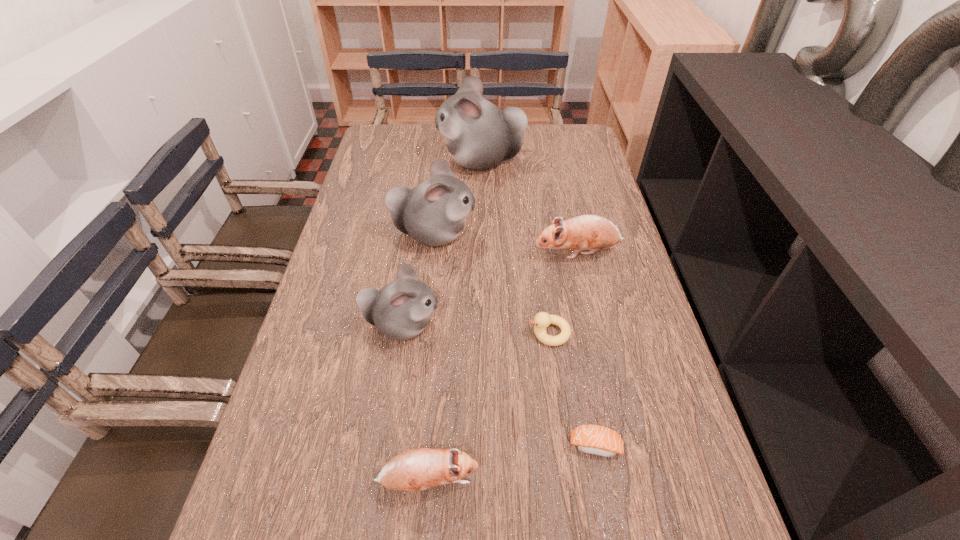
Locate an element on the screen. The image size is (960, 540). vacant space located at the face of the bigger brown hamster is located at coordinates (516, 253).

Where is `free location located 0.240m at the face of the nearest hamster`? Image resolution: width=960 pixels, height=540 pixels. free location located 0.240m at the face of the nearest hamster is located at coordinates (612, 481).

Identify the location of blank space located 0.390m at the beak of the duckling. The image size is (960, 540). (359, 333).

Locate an element on the screen. The height and width of the screenshot is (540, 960). vacant space located 0.060m at the beak of the duckling is located at coordinates (502, 333).

Where is `vacant area located 0.260m at the beak of the duckling`? This screenshot has width=960, height=540. vacant area located 0.260m at the beak of the duckling is located at coordinates (416, 333).

Locate an element on the screen. The height and width of the screenshot is (540, 960). blank area located on the front of the orange sushi is located at coordinates (608, 511).

You are a GUI agent. You are given a task and a screenshot of the screen. Output one action in this format:
    pyautogui.click(x=<x>, y=<y>)
    Task: Click on the object that is at the far edge
    
    Given the screenshot: What is the action you would take?
    (x=479, y=135)

This screenshot has height=540, width=960. Identify the location of hamster that is at the right edge. (586, 232).

At what (x,y) coordinates should I click in order to perform the action: click on sushi located at the right edge. Please return your answer as a coordinate pair (x, y). This screenshot has width=960, height=540. Looking at the image, I should click on (593, 439).

The width and height of the screenshot is (960, 540). In order to click on vacant region at the left edge of the desktop in this screenshot , I will do 336,246.